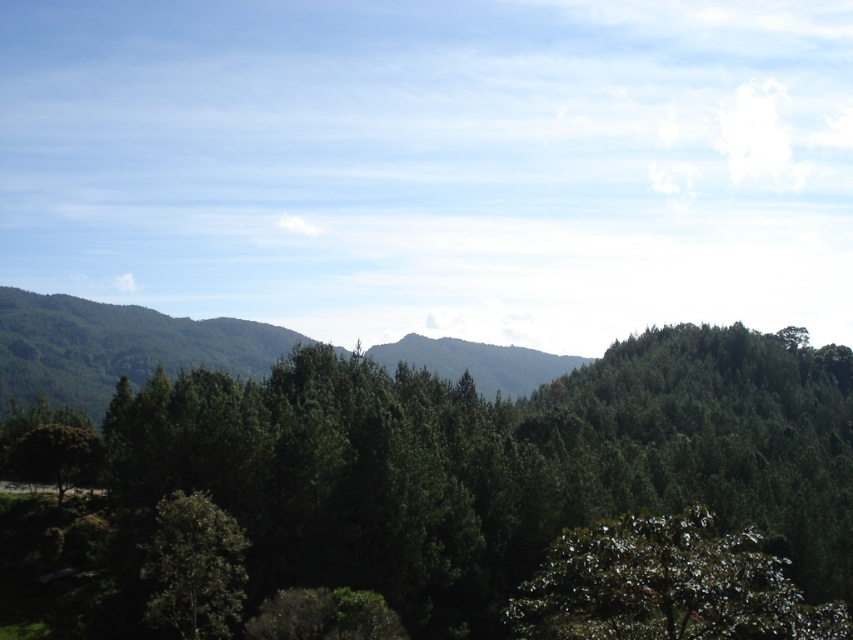
You are planning a hiking route through the landscape shown in the image. You need to decide between two paths. One path goes through the green leafy forest at center and the other goes along the green leafy hillside at left. Considering their sizes, which path would you choose if you want to take the shorter route?

The green leafy forest at center has a smaller size compared to the green leafy hillside at left, so the path through the green leafy forest at center would be shorter.

You are standing at the origin point in the image. Which direction should you walk to reach the green leafy forest at center?

The green leafy forest at center is located at point 0.744 on the x axis and 0.529 on the y axis. Since the origin is at the bottom left corner of the image, you should walk towards the upper right direction to reach it.

You are planning to place a small garden shed between the green glossy tree at lower right and the green leafy hillside at left. Considering their widths, which object will leave more space for the shed?

The green leafy hillside at left has a greater width than the green glossy tree at lower right, so placing the shed near the green leafy hillside at left would leave more space.